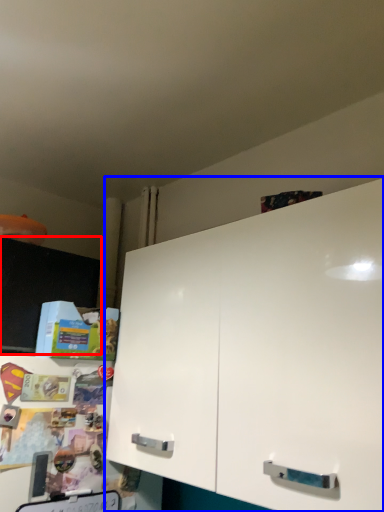
Question: Which of the following is the farthest to the observer, cabinetry (highlighted by a red box) or cabinetry (highlighted by a blue box)?

Choices:
 (A) cabinetry
 (B) cabinetry

Answer: (A)